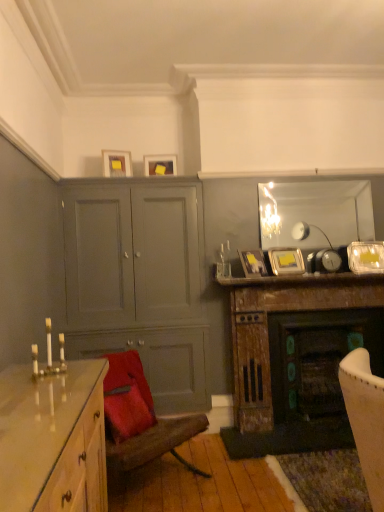
This screenshot has height=512, width=384. What are the coordinates of `vacant space that is to the left of gold metallic candle holder at left` in the screenshot? It's located at (13, 380).